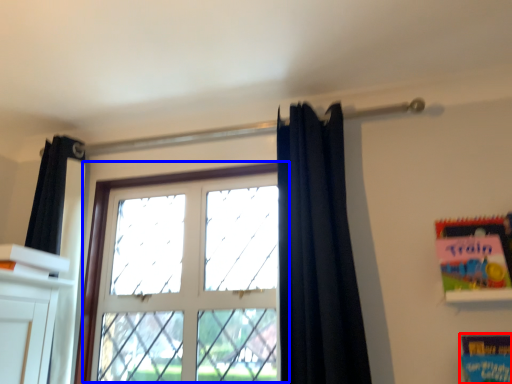
Question: Which object is closer to the camera taking this photo, paperback book (highlighted by a red box) or window (highlighted by a blue box)?

Choices:
 (A) paperback book
 (B) window

Answer: (A)